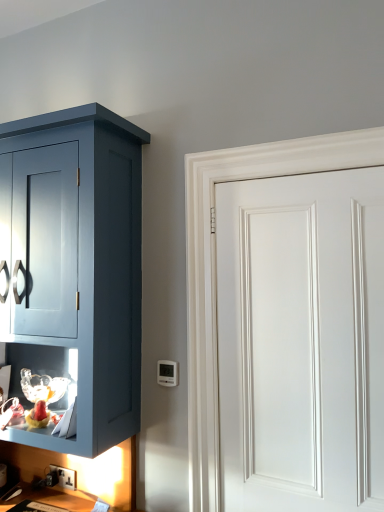
Where is `vacant area on top of white smooth door at right (from a real-world perspective)`? Image resolution: width=384 pixels, height=512 pixels. vacant area on top of white smooth door at right (from a real-world perspective) is located at coordinates (292, 174).